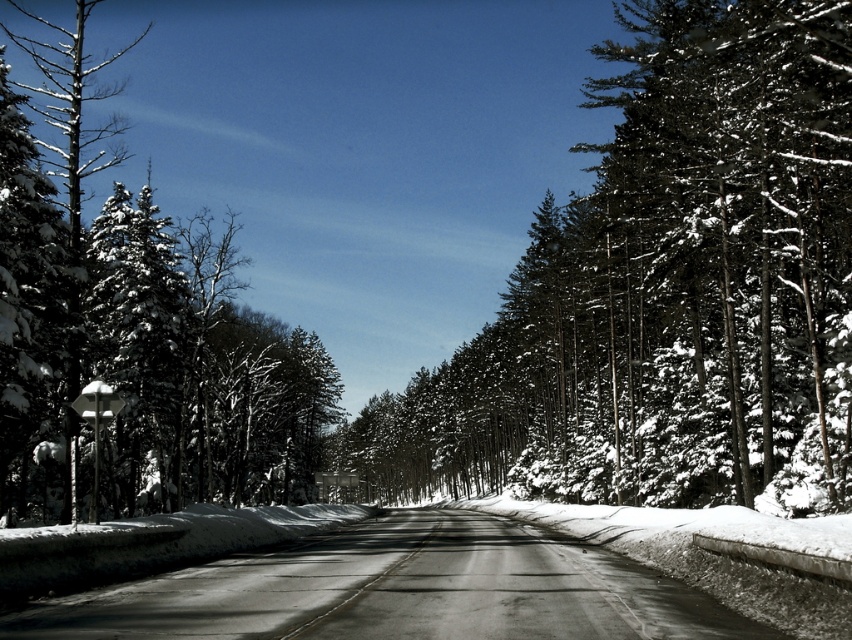
You are standing at the point marked by the coordinates in the image. Looking around, you see snow covered evergreen trees at center. Can you tell me what is located exactly at the coordinates point (x=665, y=284)?

The snow covered evergreen trees at center is located exactly at the coordinates point (x=665, y=284).